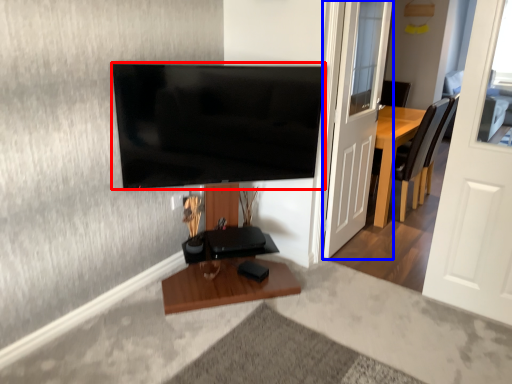
Question: Which point is closer to the camera, television (highlighted by a red box) or door (highlighted by a blue box)?

Choices:
 (A) television
 (B) door

Answer: (A)